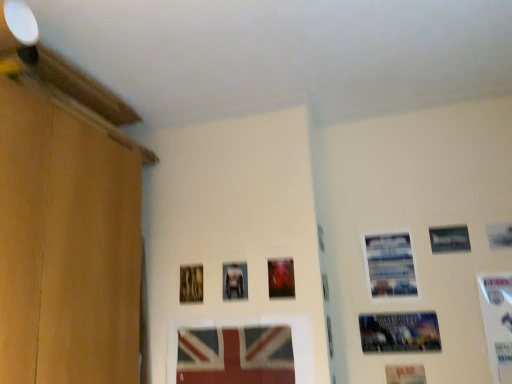
This screenshot has height=384, width=512. What do you see at coordinates (390, 265) in the screenshot?
I see `metallic silver photo frame at upper right, the fifth picture frame in the right-to-left sequence` at bounding box center [390, 265].

What is the approximate width of metallic silver picture frame at upper right, the 7th picture frame from the left?

metallic silver picture frame at upper right, the 7th picture frame from the left, is 0.39 inches wide.

Describe the element at coordinates (499, 235) in the screenshot. I see `white matte picture frame at upper right, the second picture frame from the right` at that location.

Identify the location of metallic silver picture frame at center, which is counted as the third picture frame, starting from the left. (234, 281).

This screenshot has width=512, height=384. What do you see at coordinates (281, 278) in the screenshot?
I see `metallic reflective frame at center, the 4th picture frame from the left` at bounding box center [281, 278].

This screenshot has height=384, width=512. What are the coordinates of `metallic silver photo frame at upper right, positioned as the 5th picture frame in left-to-right order` in the screenshot? It's located at (390, 265).

Consider the image. How different are the orientations of metallic poster at lower right, which is the sixth picture frame from left to right, and matte plastic picture frame at center, which is the 2th picture frame in left-to-right order, in degrees?

The angle between the facing direction of metallic poster at lower right, which is the sixth picture frame from left to right, and the facing direction of matte plastic picture frame at center, which is the 2th picture frame in left-to-right order, is 0.676 degrees.

From a real-world perspective, is metallic poster at lower right, which is the sixth picture frame from left to right, over matte plastic picture frame at center, the 8th picture frame positioned from the right?

Yes, from a real-world perspective, metallic poster at lower right, which is the sixth picture frame from left to right, is above matte plastic picture frame at center, the 8th picture frame positioned from the right.

Is metallic poster at lower right, the fourth picture frame from the right, touching matte plastic picture frame at center, the 8th picture frame positioned from the right?

metallic poster at lower right, the fourth picture frame from the right, is not next to matte plastic picture frame at center, the 8th picture frame positioned from the right, and they're not touching.

Could you measure the distance between metallic poster at lower right, the fourth picture frame from the right, and matte plastic picture frame at center, which is the 2th picture frame in left-to-right order?

metallic poster at lower right, the fourth picture frame from the right, is 20.38 inches away from matte plastic picture frame at center, which is the 2th picture frame in left-to-right order.

From a real-world perspective, is metallic reflective frame at center, the 4th picture frame from the left, located higher than white glossy picture frame at right, the first picture frame positioned from the right?

Indeed, from a real-world perspective, metallic reflective frame at center, the 4th picture frame from the left, stands above white glossy picture frame at right, the first picture frame positioned from the right.

Can we say metallic reflective frame at center, the 4th picture frame from the left, lies outside white glossy picture frame at right, which is counted as the ninth picture frame, starting from the left?

Yes.

Can you confirm if metallic reflective frame at center, the 4th picture frame from the left, is positioned to the left of white glossy picture frame at right, which is counted as the ninth picture frame, starting from the left?

Indeed, metallic reflective frame at center, the 4th picture frame from the left, is positioned on the left side of white glossy picture frame at right, which is counted as the ninth picture frame, starting from the left.

Is metallic silver photo frame at upper right, positioned as the 5th picture frame in left-to-right order, inside the boundaries of metallic silver picture frame at center, the 7th picture frame from the right, or outside?

metallic silver photo frame at upper right, positioned as the 5th picture frame in left-to-right order, is located beyond the bounds of metallic silver picture frame at center, the 7th picture frame from the right.

From a real-world perspective, is metallic silver photo frame at upper right, positioned as the 5th picture frame in left-to-right order, located beneath metallic silver picture frame at center, the 7th picture frame from the right?

Incorrect, from a real-world perspective, metallic silver photo frame at upper right, positioned as the 5th picture frame in left-to-right order, is higher than metallic silver picture frame at center, the 7th picture frame from the right.

Between metallic silver photo frame at upper right, positioned as the 5th picture frame in left-to-right order, and metallic silver picture frame at center, which is counted as the third picture frame, starting from the left, which one has more height?

With more height is metallic silver photo frame at upper right, positioned as the 5th picture frame in left-to-right order.

Between white glossy picture frame at right, which is counted as the ninth picture frame, starting from the left, and metallic silver picture frame at center, which is counted as the third picture frame, starting from the left, which one has more height?

With more height is white glossy picture frame at right, which is counted as the ninth picture frame, starting from the left.

Is white glossy picture frame at right, the first picture frame positioned from the right, in front of or behind metallic silver picture frame at center, which is counted as the third picture frame, starting from the left, in the image?

white glossy picture frame at right, the first picture frame positioned from the right, is positioned closer to the viewer than metallic silver picture frame at center, which is counted as the third picture frame, starting from the left.

Is point (493, 350) more distant than point (230, 295)?

No.

Between metallic silver picture frame at upper right, the 7th picture frame from the left, and metallic silver photo frame at upper right, positioned as the 5th picture frame in left-to-right order, which one appears on the left side from the viewer's perspective?

From the viewer's perspective, metallic silver photo frame at upper right, positioned as the 5th picture frame in left-to-right order, appears more on the left side.

Could you tell me if metallic silver picture frame at upper right, the 3th picture frame in the right-to-left sequence, is turned towards metallic silver photo frame at upper right, positioned as the 5th picture frame in left-to-right order?

No.

Can you confirm if metallic silver picture frame at upper right, the 3th picture frame in the right-to-left sequence, is taller than metallic silver photo frame at upper right, positioned as the 5th picture frame in left-to-right order?

No.

Image resolution: width=512 pixels, height=384 pixels. There is a metallic silver photo frame at upper right, positioned as the 5th picture frame in left-to-right order. In order to click on the 1st picture frame above it (from the image's perspective) in this screenshot , I will do `click(449, 239)`.

In terms of width, does white matte picture frame at upper right, the second picture frame from the right, look wider or thinner when compared to metallic silver picture frame at center, the 7th picture frame from the right?

Considering their sizes, white matte picture frame at upper right, the second picture frame from the right, looks slimmer than metallic silver picture frame at center, the 7th picture frame from the right.

Measure the distance between white matte picture frame at upper right, the eighth picture frame positioned from the left, and metallic silver picture frame at center, which is counted as the third picture frame, starting from the left.

They are 3.37 feet apart.

Is white matte picture frame at upper right, the second picture frame from the right, shorter than metallic silver picture frame at center, the 7th picture frame from the right?

Correct, white matte picture frame at upper right, the second picture frame from the right, is not as tall as metallic silver picture frame at center, the 7th picture frame from the right.

Is point (490, 247) positioned in front of point (224, 274)?

Yes, point (490, 247) is in front of point (224, 274).

From a real-world perspective, which is physically above, metallic silver photo frame at upper right, the fifth picture frame in the right-to-left sequence, or white matte picture frame at upper right, the eighth picture frame positioned from the left?

From a 3D spatial view, white matte picture frame at upper right, the eighth picture frame positioned from the left, is above.

Is point (377, 280) less distant than point (490, 235)?

No, it is behind (490, 235).

Would you say metallic silver photo frame at upper right, the fifth picture frame in the right-to-left sequence, is a long distance from white matte picture frame at upper right, the eighth picture frame positioned from the left?

No, there isn't a large distance between metallic silver photo frame at upper right, the fifth picture frame in the right-to-left sequence, and white matte picture frame at upper right, the eighth picture frame positioned from the left.

Considering the sizes of objects metallic silver photo frame at upper right, positioned as the 5th picture frame in left-to-right order, and white matte picture frame at upper right, the second picture frame from the right, in the image provided, who is taller, metallic silver photo frame at upper right, positioned as the 5th picture frame in left-to-right order, or white matte picture frame at upper right, the second picture frame from the right,?

Standing taller between the two is metallic silver photo frame at upper right, positioned as the 5th picture frame in left-to-right order.

I want to click on the 4th picture frame to the left when counting from the metallic poster at lower right, the fourth picture frame from the right, so click(234, 356).

The width and height of the screenshot is (512, 384). There is a metallic reflective frame at center, the 4th picture frame from the left. Find the location of `the 2nd picture frame below it (from a real-world perspective)`. the 2nd picture frame below it (from a real-world perspective) is located at coordinates (497, 322).

Considering their positions, is metallic reflective frame at center, the 6th picture frame positioned from the right, positioned closer to white glossy picture frame at right, the first picture frame positioned from the right, than wooden picture frame at center, positioned as the ninth picture frame in right-to-left order?

metallic reflective frame at center, the 6th picture frame positioned from the right.

Looking at the image, which one is located further to matte plastic picture frame at center, the 8th picture frame positioned from the right, wooden picture frame at center, positioned as the ninth picture frame in right-to-left order, or white glossy picture frame at right, the first picture frame positioned from the right?

white glossy picture frame at right, the first picture frame positioned from the right, lies further to matte plastic picture frame at center, the 8th picture frame positioned from the right, than the other object.

Based on their spatial positions, is metallic silver picture frame at center, the 7th picture frame from the right, or white matte picture frame at upper right, the eighth picture frame positioned from the left, further from metallic silver photo frame at upper right, positioned as the 5th picture frame in left-to-right order?

The object further to metallic silver photo frame at upper right, positioned as the 5th picture frame in left-to-right order, is metallic silver picture frame at center, the 7th picture frame from the right.

Which object lies further to the anchor point metallic silver picture frame at upper right, the 3th picture frame in the right-to-left sequence, wooden picture frame at center, positioned as the ninth picture frame in right-to-left order, or white matte picture frame at upper right, the second picture frame from the right?

wooden picture frame at center, positioned as the ninth picture frame in right-to-left order, is further to metallic silver picture frame at upper right, the 3th picture frame in the right-to-left sequence.

When comparing their distances from wooden picture frame at center, positioned as the ninth picture frame in right-to-left order, does metallic silver picture frame at center, which is counted as the third picture frame, starting from the left, or metallic silver photo frame at upper right, the fifth picture frame in the right-to-left sequence, seem further?

Based on the image, metallic silver photo frame at upper right, the fifth picture frame in the right-to-left sequence, appears to be further to wooden picture frame at center, positioned as the ninth picture frame in right-to-left order.

When comparing their distances from wooden picture frame at center, the first picture frame in the left-to-right sequence, does metallic silver photo frame at upper right, positioned as the 5th picture frame in left-to-right order, or matte plastic picture frame at center, which is the 2th picture frame in left-to-right order, seem closer?

matte plastic picture frame at center, which is the 2th picture frame in left-to-right order, lies closer to wooden picture frame at center, the first picture frame in the left-to-right sequence, than the other object.

Based on their spatial positions, is wooden picture frame at center, the first picture frame in the left-to-right sequence, or white matte picture frame at upper right, the second picture frame from the right, closer to white glossy picture frame at right, the first picture frame positioned from the right?

white matte picture frame at upper right, the second picture frame from the right.

Looking at the image, which one is located further to white matte picture frame at upper right, the eighth picture frame positioned from the left, metallic silver photo frame at upper right, positioned as the 5th picture frame in left-to-right order, or metallic poster at lower right, the fourth picture frame from the right?

metallic poster at lower right, the fourth picture frame from the right, lies further to white matte picture frame at upper right, the eighth picture frame positioned from the left, than the other object.

Locate an element on the screen. picture frame between metallic silver picture frame at center, which is counted as the third picture frame, starting from the left, and metallic silver photo frame at upper right, the fifth picture frame in the right-to-left sequence is located at coordinates (281, 278).

Identify the location of picture frame between metallic reflective frame at center, the 6th picture frame positioned from the right, and metallic poster at lower right, which is the sixth picture frame from left to right. (390, 265).